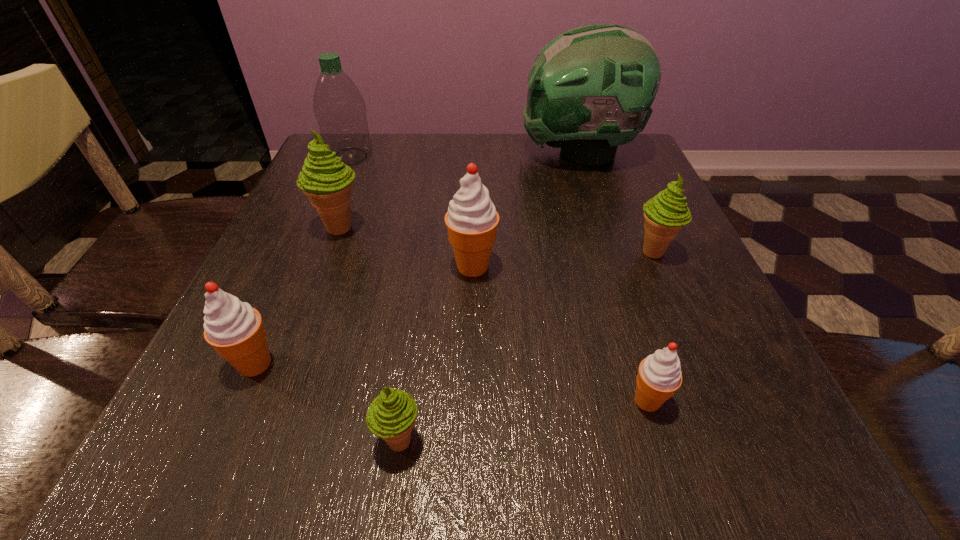
In the image, there is a desktop. Identify the location of blank space at the far edge. (x=432, y=138).

You are a GUI agent. You are given a task and a screenshot of the screen. Output one action in this format:
    pyautogui.click(x=<x>, y=<y>)
    Task: Click on the vacant space at the near edge of the desktop
    
    Given the screenshot: What is the action you would take?
    pyautogui.click(x=622, y=433)

I want to click on vacant space at the left edge of the desktop, so click(324, 291).

This screenshot has height=540, width=960. Identify the location of vacant space at the right edge. (660, 411).

Locate an element on the screen. This screenshot has width=960, height=540. vacant region at the far left corner of the desktop is located at coordinates (378, 161).

The width and height of the screenshot is (960, 540). I want to click on free spot between the smallest red icecream and the leftmost green icecream, so click(493, 314).

Where is `free space between the fourth object from left to right and the smallest red icecream`? The image size is (960, 540). free space between the fourth object from left to right and the smallest red icecream is located at coordinates (523, 421).

At what (x,y) coordinates should I click in order to perform the action: click on free space between the rightmost red icecream and the third icecream from right to left. Please return your answer as a coordinate pair (x, y). This screenshot has width=960, height=540. Looking at the image, I should click on (560, 333).

At what (x,y) coordinates should I click in order to perform the action: click on free point between the rightmost icecream and the tallest object. Please return your answer as a coordinate pair (x, y). This screenshot has width=960, height=540. Looking at the image, I should click on (616, 202).

At what (x,y) coordinates should I click in order to perform the action: click on free space that is in between the nearest green icecream and the rightmost green icecream. Please return your answer as a coordinate pair (x, y). The width and height of the screenshot is (960, 540). Looking at the image, I should click on (527, 346).